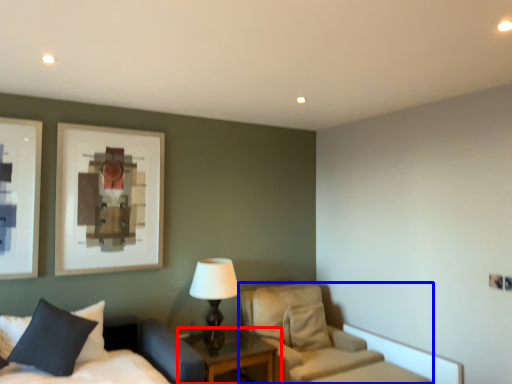
Question: Which object is closer to the camera taking this photo, nightstand (highlighted by a red box) or chair (highlighted by a blue box)?

Choices:
 (A) nightstand
 (B) chair

Answer: (A)